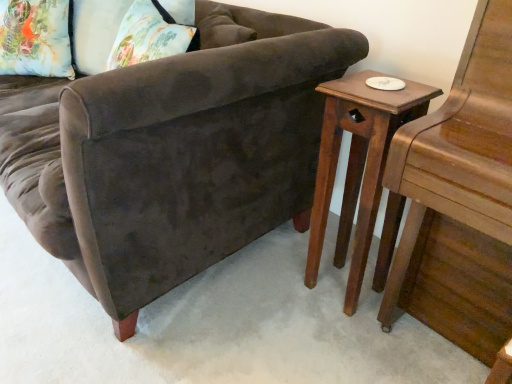
Find the location of `free spot in front of wooden side table at right`. free spot in front of wooden side table at right is located at coordinates [354, 340].